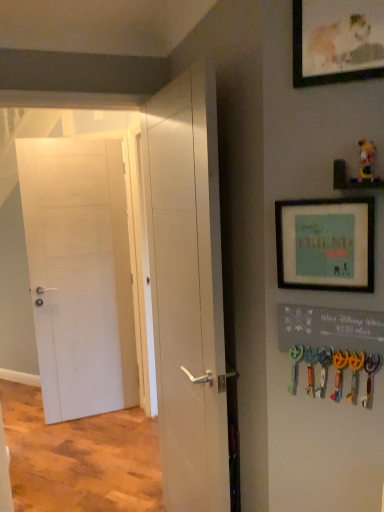
Question: Is teal matte picture frame at upper right, which appears as the second picture frame when viewed from the top, at the back of plush yellow bear at upper right?

Choices:
 (A) yes
 (B) no

Answer: (B)

Question: From the image's perspective, is plush yellow bear at upper right over teal matte picture frame at upper right, which appears as the second picture frame when viewed from the top?

Choices:
 (A) yes
 (B) no

Answer: (A)

Question: Is plush yellow bear at upper right at the right side of teal matte picture frame at upper right, the 1th picture frame from the bottom?

Choices:
 (A) yes
 (B) no

Answer: (A)

Question: Is plush yellow bear at upper right directly adjacent to teal matte picture frame at upper right, which appears as the second picture frame when viewed from the top?

Choices:
 (A) no
 (B) yes

Answer: (A)

Question: Can you confirm if plush yellow bear at upper right is smaller than teal matte picture frame at upper right, the 1th picture frame from the bottom?

Choices:
 (A) no
 (B) yes

Answer: (B)

Question: Does plush yellow bear at upper right have a greater width compared to teal matte picture frame at upper right, the 1th picture frame from the bottom?

Choices:
 (A) no
 (B) yes

Answer: (B)

Question: Considering the relative positions of teal matte picture frame at upper right, which appears as the second picture frame when viewed from the top, and plush yellow bear at upper right in the image provided, is teal matte picture frame at upper right, which appears as the second picture frame when viewed from the top, to the right of plush yellow bear at upper right from the viewer's perspective?

Choices:
 (A) no
 (B) yes

Answer: (A)

Question: Is teal matte picture frame at upper right, which appears as the second picture frame when viewed from the top, touching plush yellow bear at upper right?

Choices:
 (A) no
 (B) yes

Answer: (A)

Question: Is teal matte picture frame at upper right, the 1th picture frame from the bottom, wider than plush yellow bear at upper right?

Choices:
 (A) no
 (B) yes

Answer: (A)

Question: Is teal matte picture frame at upper right, which appears as the second picture frame when viewed from the top, behind plush yellow bear at upper right?

Choices:
 (A) yes
 (B) no

Answer: (A)

Question: Can we say teal matte picture frame at upper right, which appears as the second picture frame when viewed from the top, lies outside plush yellow bear at upper right?

Choices:
 (A) no
 (B) yes

Answer: (B)

Question: From a real-world perspective, is teal matte picture frame at upper right, the 1th picture frame from the bottom, over plush yellow bear at upper right?

Choices:
 (A) no
 (B) yes

Answer: (A)

Question: Could you tell me if white matte door at center, placed as the 2th door when sorted from back to front, is turned towards white matte door at left, which is counted as the second door, starting from the front?

Choices:
 (A) no
 (B) yes

Answer: (A)